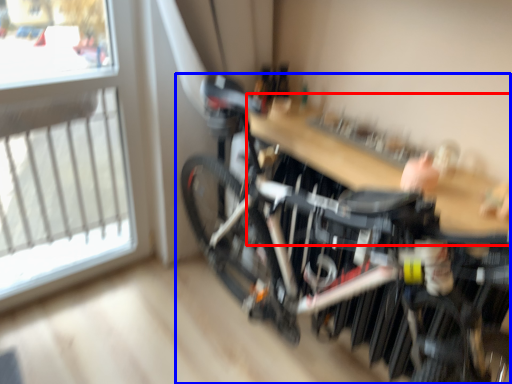
Question: Among these objects, which one is farthest to the camera, table (highlighted by a red box) or bicycle (highlighted by a blue box)?

Choices:
 (A) table
 (B) bicycle

Answer: (A)